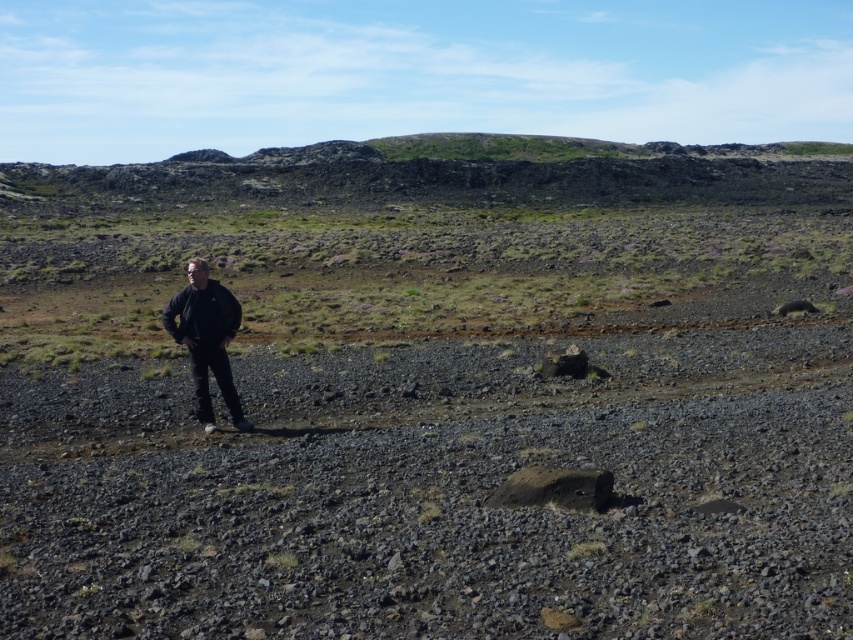
Question: Does black matte jacket at center have a larger size compared to smooth gray rock at center?

Choices:
 (A) no
 (B) yes

Answer: (B)

Question: Is black matte jacket at center wider than smooth gray rock at center?

Choices:
 (A) yes
 (B) no

Answer: (A)

Question: Which object appears closest to the camera in this image?

Choices:
 (A) black matte jacket at center
 (B) smooth gray rock at center

Answer: (A)

Question: From the image, what is the correct spatial relationship of black matte jacket at center in relation to smooth gray rock at center?

Choices:
 (A) right
 (B) left

Answer: (B)